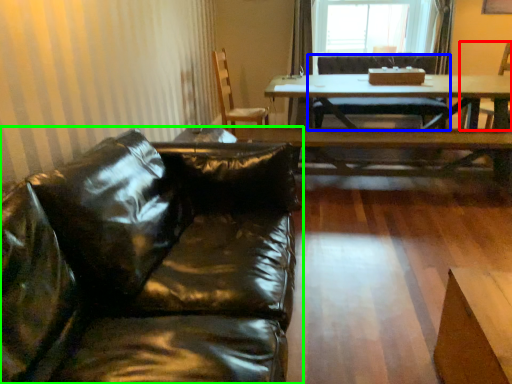
Question: Based on their relative distances, which object is farther from armchair (highlighted by a red box)? Choose from chair (highlighted by a blue box) and studio couch (highlighted by a green box).

Choices:
 (A) chair
 (B) studio couch

Answer: (B)